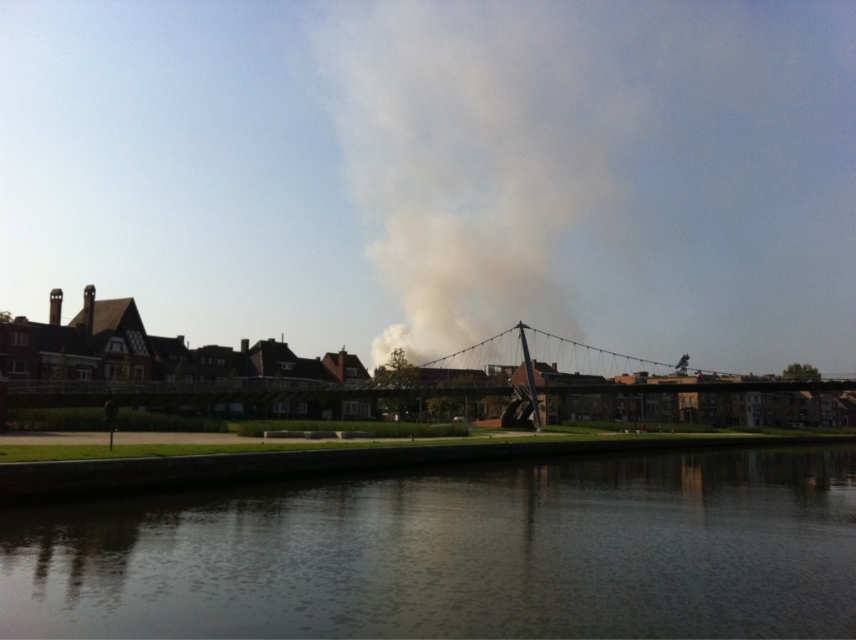
Consider the image. You are standing on the riverside and want to take a photo of the dark reflective water at lower center and the metallic gray suspension bridge at center. Which object will appear taller in the photo?

The metallic gray suspension bridge at center will appear taller in the photo because the dark reflective water at lower center has a lesser height compared to it.

You are standing at the riverside and see the dark reflective water at lower center and the gray smoke at center. Which object is nearer to you?

The dark reflective water at lower center is closer to the viewer than the gray smoke at center.

You are standing on the riverside and see the dark reflective water at lower center and the gray smoke at center. Which object is positioned to the left of the other?

The dark reflective water at lower center is to the left of the gray smoke at center.